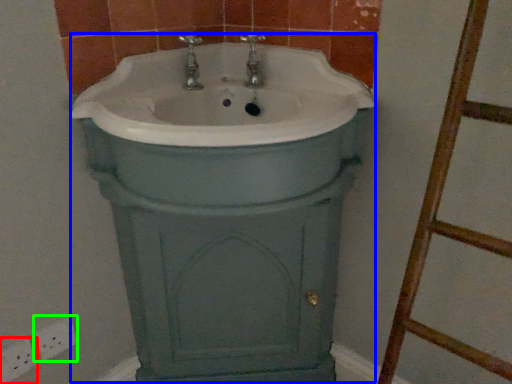
Question: Based on their relative distances, which object is farther from electric outlet (highlighted by a red box)? Choose from porcelain (highlighted by a blue box) and electric outlet (highlighted by a green box).

Choices:
 (A) porcelain
 (B) electric outlet

Answer: (A)